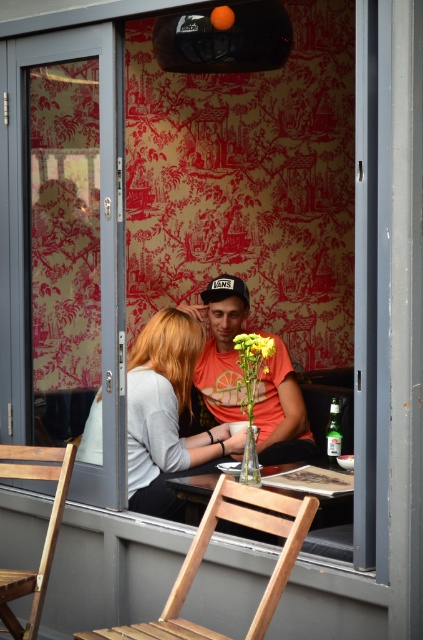
Is point (216, 492) more distant than point (14, 570)?

No, (216, 492) is closer to viewer.

Who is positioned more to the left, light brown wooden chair at lower center or wooden chair at lower left?

wooden chair at lower left is more to the left.

Between point (233, 490) and point (43, 572), which one is positioned in front?

Positioned in front is point (233, 490).

I want to click on light brown wooden chair at lower center, so click(x=205, y=550).

Does matte gray sweater at center appear under black fabric baseball cap at center?

Yes, matte gray sweater at center is below black fabric baseball cap at center.

How distant is matte gray sweater at center from black fabric baseball cap at center?

matte gray sweater at center and black fabric baseball cap at center are 37.04 inches apart.

Which is in front, point (214, 451) or point (219, 285)?

Point (214, 451) is more forward.

The width and height of the screenshot is (423, 640). In order to click on matte gray sweater at center in this screenshot , I will do `click(165, 412)`.

Locate an element on the screen. This screenshot has height=640, width=423. black fabric baseball cap at center is located at coordinates (225, 289).

Consider the image. Does black fabric baseball cap at center lie in front of yellow matte flower at center?

No, black fabric baseball cap at center is behind yellow matte flower at center.

Image resolution: width=423 pixels, height=640 pixels. I want to click on black fabric baseball cap at center, so click(x=225, y=289).